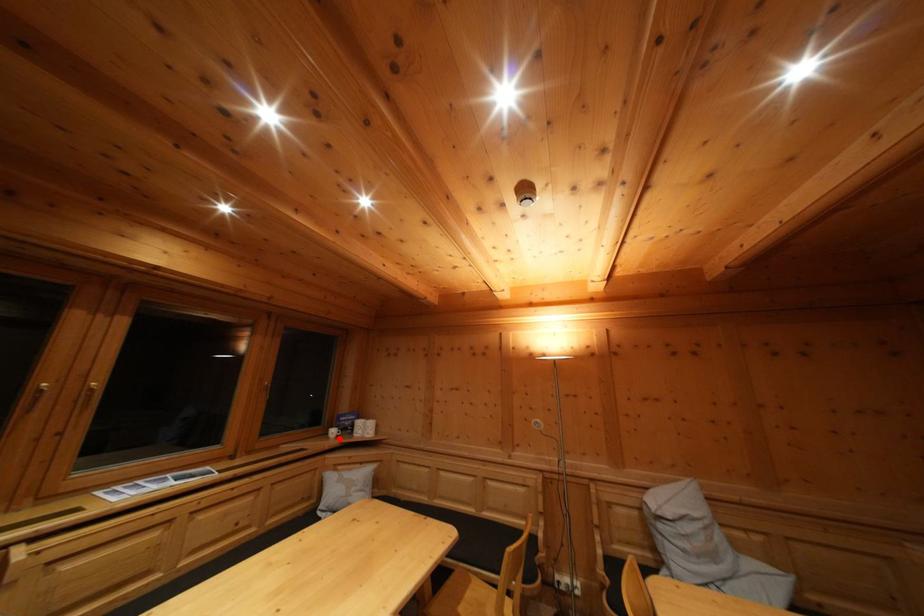
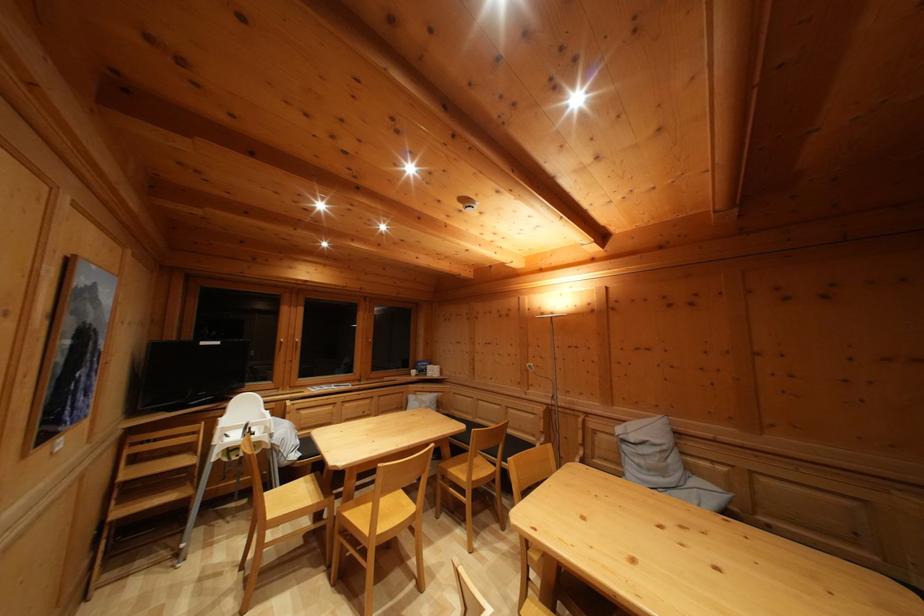
Where in the second image is the point corresponding to the highlighted location from the first image?

(419, 379)